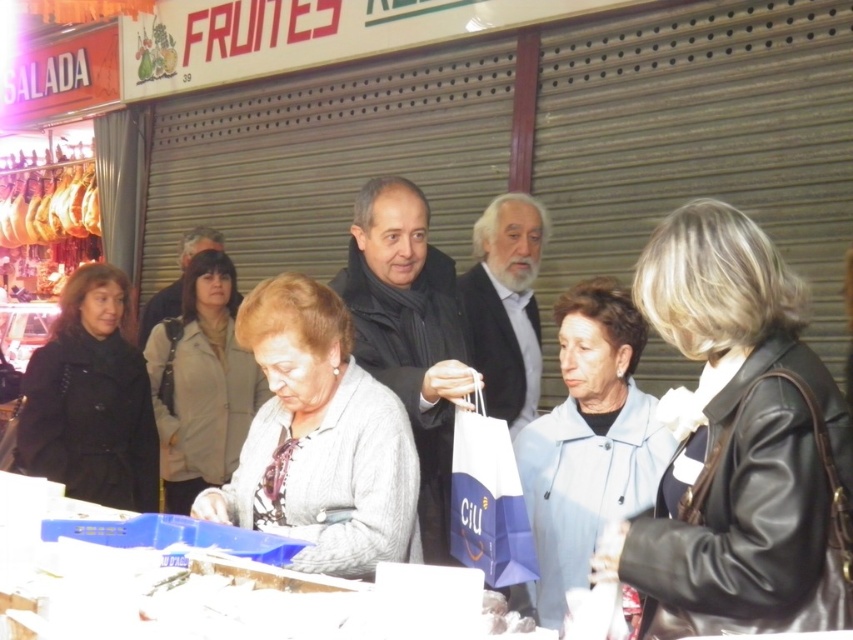
Locate an element on the screen. Image resolution: width=853 pixels, height=640 pixels. dark gray jacket at center is located at coordinates point(408,332).

Between point (410, 250) and point (194, 236), which one is positioned in front?

Point (410, 250)

The image size is (853, 640). Describe the element at coordinates (408, 332) in the screenshot. I see `dark gray jacket at center` at that location.

The height and width of the screenshot is (640, 853). I want to click on dark gray jacket at center, so click(408, 332).

Is white paper shopping bag at center positioned in front of light brown leather jacket at center?

Yes, white paper shopping bag at center is in front of light brown leather jacket at center.

Is point (465, 445) behind point (207, 236)?

No, (465, 445) is closer to viewer.

This screenshot has height=640, width=853. Find the location of `white paper shopping bag at center`. white paper shopping bag at center is located at coordinates (488, 499).

Find the location of a particular element. Image resolution: width=853 pixels, height=640 pixels. white paper shopping bag at center is located at coordinates click(x=488, y=499).

Based on the photo, which is more to the left, white beard at center or white paper shopping bag at center?

Positioned to the left is white paper shopping bag at center.

Which is above, white beard at center or white paper shopping bag at center?

Positioned higher is white beard at center.

The image size is (853, 640). Describe the element at coordinates (506, 305) in the screenshot. I see `white beard at center` at that location.

The width and height of the screenshot is (853, 640). Find the location of `white beard at center`. white beard at center is located at coordinates (506, 305).